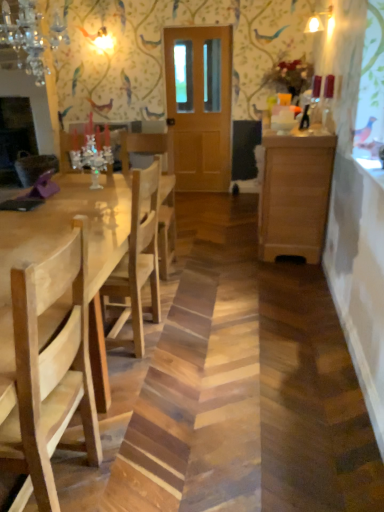
Question: Is natural wood table at left in contact with wooden cabinet at right?

Choices:
 (A) yes
 (B) no

Answer: (B)

Question: Is natural wood table at left facing away from wooden cabinet at right?

Choices:
 (A) yes
 (B) no

Answer: (B)

Question: Is natural wood table at left further to the viewer compared to wooden cabinet at right?

Choices:
 (A) yes
 (B) no

Answer: (B)

Question: Is natural wood table at left thinner than wooden cabinet at right?

Choices:
 (A) yes
 (B) no

Answer: (B)

Question: Is wooden cabinet at right surrounded by natural wood table at left?

Choices:
 (A) no
 (B) yes

Answer: (A)

Question: Is wooden cabinet at right taller or shorter than natural wood chair at left?

Choices:
 (A) short
 (B) tall

Answer: (A)

Question: From a real-world perspective, is wooden cabinet at right above or below natural wood chair at left?

Choices:
 (A) above
 (B) below

Answer: (B)

Question: Is wooden cabinet at right in front of or behind natural wood chair at left in the image?

Choices:
 (A) front
 (B) behind

Answer: (B)

Question: Considering the positions of wooden cabinet at right and natural wood chair at left in the image, is wooden cabinet at right wider or thinner than natural wood chair at left?

Choices:
 (A) thin
 (B) wide

Answer: (B)

Question: Would you say crystal glass chandelier at upper left is to the left or to the right of natural wood table at left in the picture?

Choices:
 (A) left
 (B) right

Answer: (B)

Question: Looking at the image, does crystal glass chandelier at upper left seem bigger or smaller compared to natural wood table at left?

Choices:
 (A) big
 (B) small

Answer: (B)

Question: From a real-world perspective, is crystal glass chandelier at upper left above or below natural wood table at left?

Choices:
 (A) below
 (B) above

Answer: (B)

Question: Considering the positions of point (64, 28) and point (13, 257), is point (64, 28) closer or farther from the camera than point (13, 257)?

Choices:
 (A) closer
 (B) farther

Answer: (B)

Question: From the image's perspective, relative to natural wood table at left, is wooden cabinet at right above or below?

Choices:
 (A) above
 (B) below

Answer: (A)

Question: Would you say wooden cabinet at right is inside or outside natural wood table at left?

Choices:
 (A) outside
 (B) inside

Answer: (A)